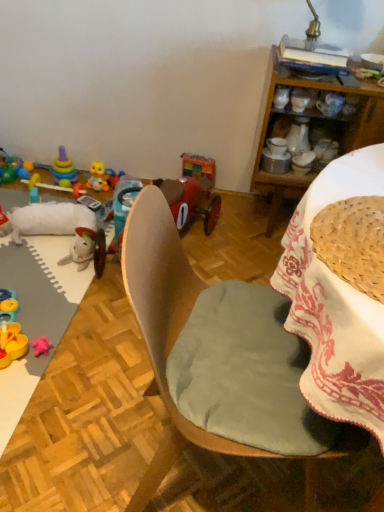
Where is `unoccupied space behind rubber duck at lower left, the 3th toy from the left`? unoccupied space behind rubber duck at lower left, the 3th toy from the left is located at coordinates (49, 313).